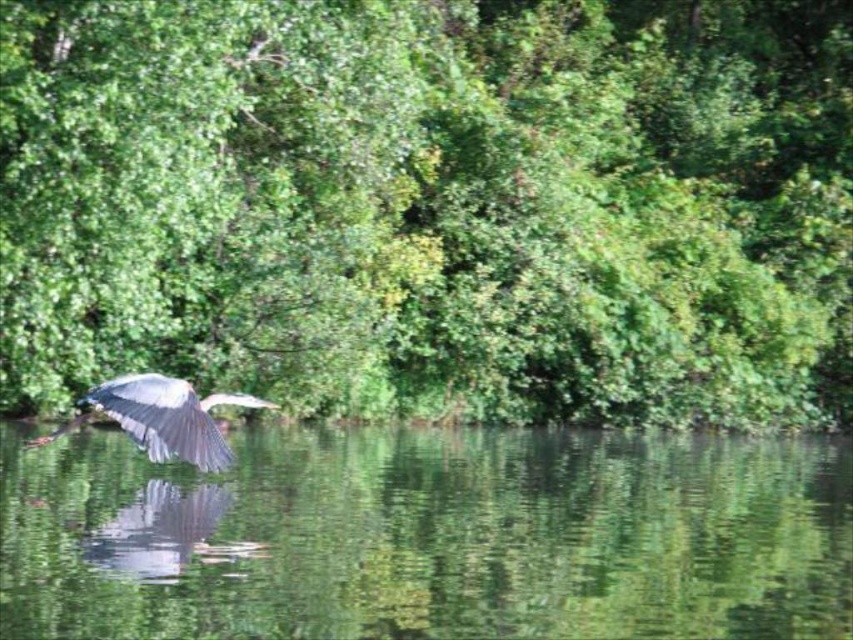
Question: Can you confirm if green leafy trees at upper center is wider than green reflective water at center?

Choices:
 (A) no
 (B) yes

Answer: (B)

Question: Estimate the real-world distances between objects in this image. Which object is closer to the green leafy trees at upper center?

Choices:
 (A) green reflective water at center
 (B) gray feathered bird at left

Answer: (A)

Question: Does green leafy trees at upper center appear over green reflective water at center?

Choices:
 (A) yes
 (B) no

Answer: (A)

Question: From the image, what is the correct spatial relationship of green leafy trees at upper center in relation to green reflective water at center?

Choices:
 (A) left
 (B) right

Answer: (B)

Question: Among these points, which one is nearest to the camera?

Choices:
 (A) (579, 202)
 (B) (180, 401)
 (C) (746, 442)

Answer: (B)

Question: Which object appears farthest from the camera in this image?

Choices:
 (A) gray feathered bird at left
 (B) green leafy trees at upper center

Answer: (B)